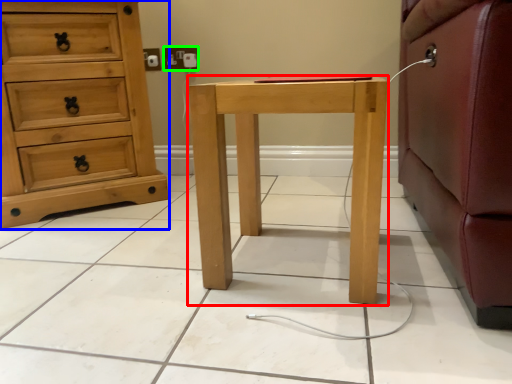
Question: Which is nearer to the nightstand (highlighted by a red box)? chest of drawers (highlighted by a blue box) or electric outlet (highlighted by a green box).

Choices:
 (A) chest of drawers
 (B) electric outlet

Answer: (A)